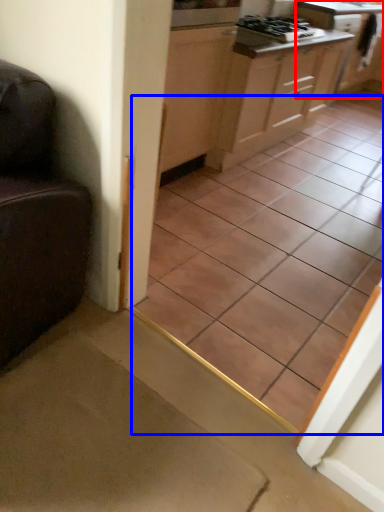
Question: Which of the following is the farthest to the observer, cabinetry (highlighted by a red box) or ceramic tile (highlighted by a blue box)?

Choices:
 (A) cabinetry
 (B) ceramic tile

Answer: (A)